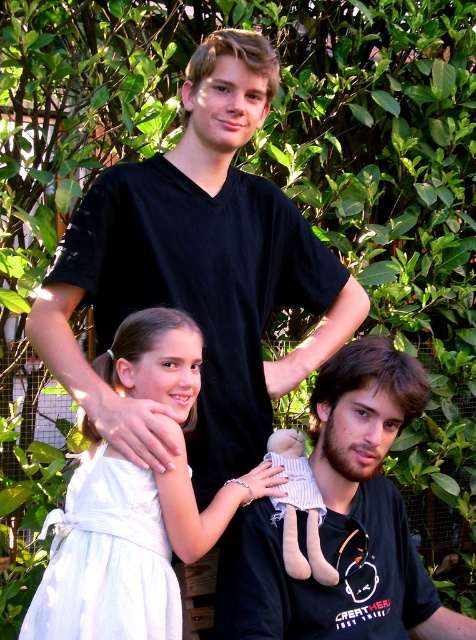
You are standing in a garden and see a person wearing a matte black shirt at center. If you want to hand them a book without moving closer, can you do it? Please explain.

The matte black shirt at center is 2.35 meters away from the viewer. Since the distance is too far to reach comfortably, you cannot hand them the book without moving closer.

Looking at the scene described, where is the matte black shirt at center in relation to the soft beige fabric doll at lower center?

The matte black shirt at center is to the right of the soft beige fabric doll at lower center.

You are a photographer setting up for a group photo. You have a camera with a lens that can focus on objects within a 16 inch range. You need to ensure both the white cotton dress at center and the soft beige fabric doll at lower center are in focus. Can you capture both in the same photo without adjusting your camera settings?

The white cotton dress at center and the soft beige fabric doll at lower center are 15.81 inches apart, which is within the 16 inch focus range of the camera lens. Therefore, both objects can be captured in focus in the same photo without adjusting the camera settings.